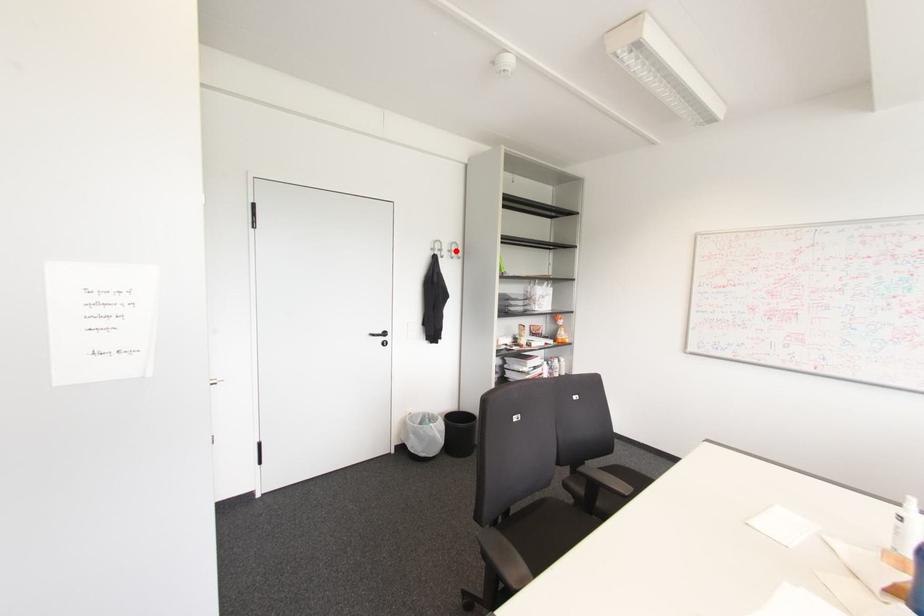
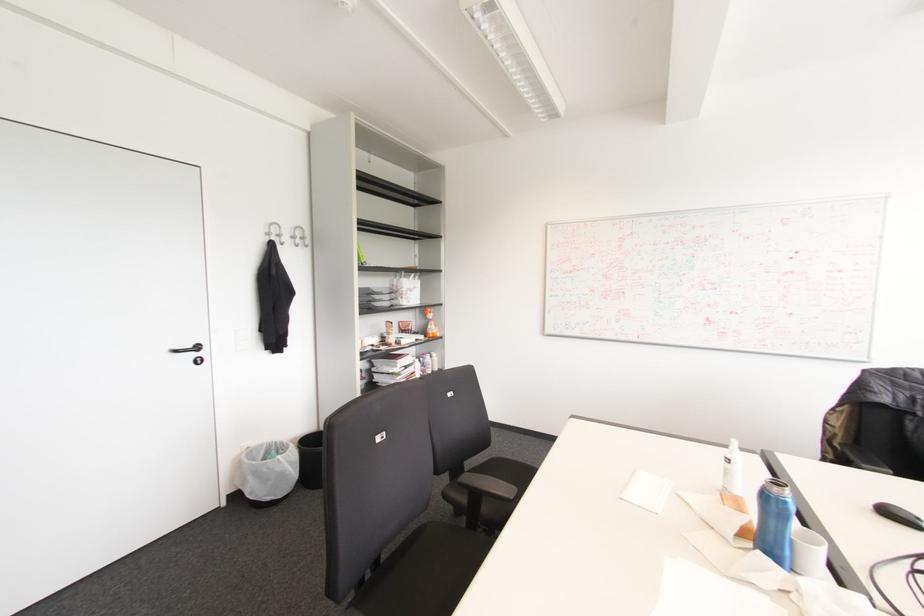
In the second image, find the point that corresponds to the highlighted location in the first image.

(301, 238)